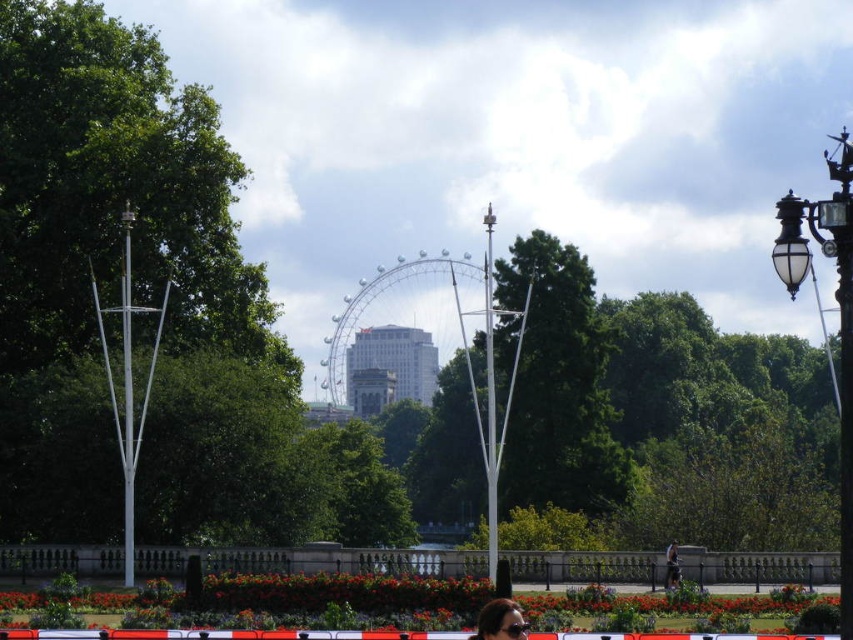
Question: Can you confirm if concrete barrier at lower center is wider than matte black sunglasses at lower center?

Choices:
 (A) yes
 (B) no

Answer: (A)

Question: Can you confirm if concrete barrier at lower center is positioned above matte black sunglasses at lower center?

Choices:
 (A) yes
 (B) no

Answer: (B)

Question: Does concrete barrier at lower center appear under matte black sunglasses at lower center?

Choices:
 (A) yes
 (B) no

Answer: (A)

Question: Which point is farther to the camera?

Choices:
 (A) (514, 636)
 (B) (45, 557)

Answer: (B)

Question: Which of the following is the closest to the observer?

Choices:
 (A) concrete barrier at lower center
 (B) matte black sunglasses at lower center

Answer: (B)